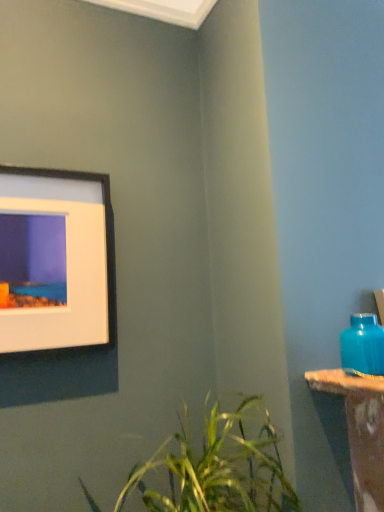
Question: Is point (369, 366) closer or farther from the camera than point (11, 295)?

Choices:
 (A) farther
 (B) closer

Answer: (B)

Question: From the image's perspective, is matte blue vase at right located above or below black matte picture frame at upper left?

Choices:
 (A) below
 (B) above

Answer: (A)

Question: Is matte blue vase at right in front of or behind black matte picture frame at upper left in the image?

Choices:
 (A) behind
 (B) front

Answer: (B)

Question: Which is correct: black matte picture frame at upper left is inside matte blue vase at right, or outside of it?

Choices:
 (A) inside
 (B) outside

Answer: (B)

Question: From the image's perspective, relative to matte blue vase at right, is black matte picture frame at upper left above or below?

Choices:
 (A) below
 (B) above

Answer: (B)

Question: Is black matte picture frame at upper left in front of or behind matte blue vase at right in the image?

Choices:
 (A) front
 (B) behind

Answer: (B)

Question: Considering the positions of black matte picture frame at upper left and matte blue vase at right in the image, is black matte picture frame at upper left bigger or smaller than matte blue vase at right?

Choices:
 (A) big
 (B) small

Answer: (A)